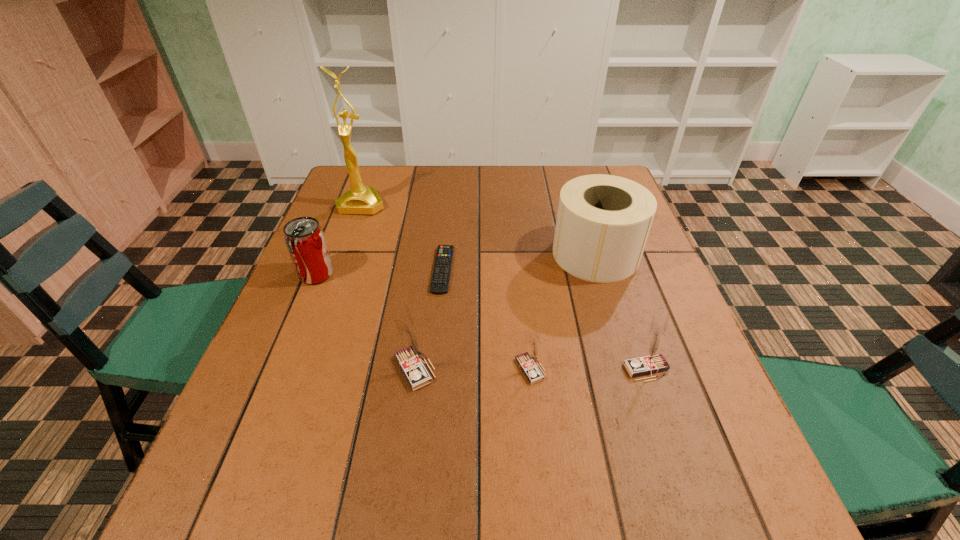
The height and width of the screenshot is (540, 960). I want to click on free location located on the left of the second matchbox from right to left, so click(x=470, y=369).

This screenshot has width=960, height=540. Identify the location of free space located on the left of the rightmost matchbox. (465, 369).

The height and width of the screenshot is (540, 960). What are the coordinates of `blank area located on the left of the remote control` in the screenshot? It's located at (389, 270).

Locate an element on the screen. vacant space situated 0.090m on the left of the toilet tissue is located at coordinates (518, 254).

Identify the location of vacant area situated 0.050m on the front-facing side of the award. (353, 226).

I want to click on free space located on the right of the pop soda, so click(391, 274).

Find the location of a particular element. This screenshot has width=960, height=540. object situated at the far edge is located at coordinates (360, 199).

In order to click on award present at the left edge in this screenshot , I will do pyautogui.click(x=360, y=199).

Locate an element on the screen. This screenshot has width=960, height=540. pop soda at the left edge is located at coordinates 304,237.

At what (x,y) coordinates should I click in order to perform the action: click on matchbox present at the right edge. Please return your answer as a coordinate pair (x, y). Looking at the image, I should click on (652, 361).